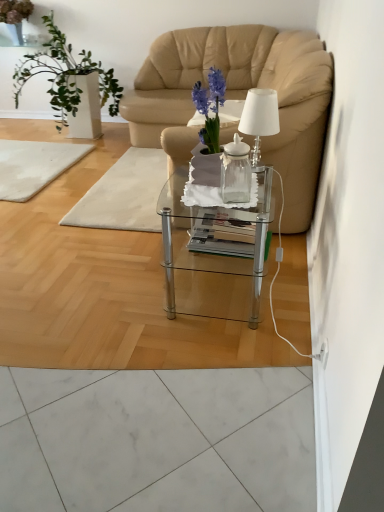
This screenshot has height=512, width=384. In order to click on vacant space in front of clear glass coffee table at center in this screenshot , I will do `click(222, 366)`.